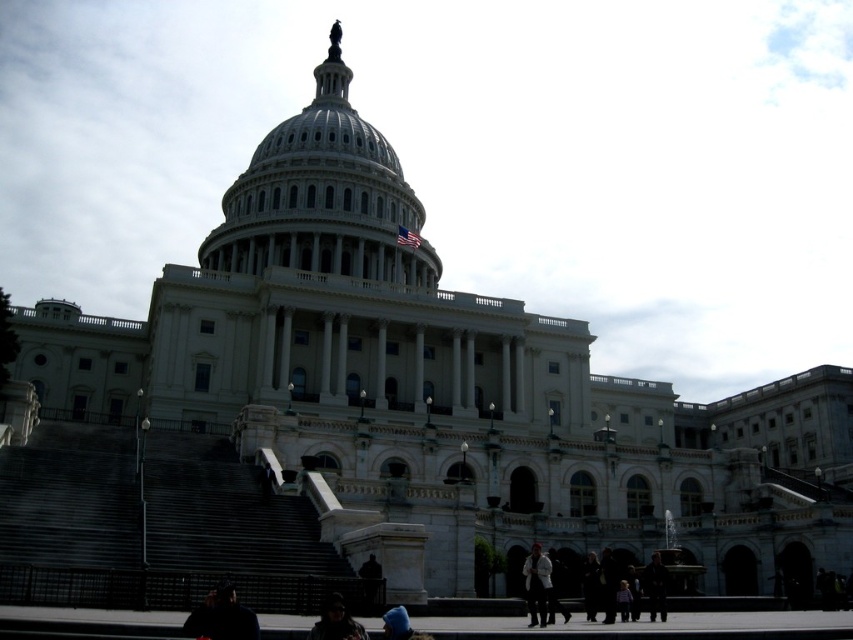
Which is above, dark brown leather jacket at lower right or dark clothing at lower center?

dark brown leather jacket at lower right

Can you confirm if dark brown leather jacket at lower right is taller than dark clothing at lower center?

No, dark brown leather jacket at lower right is not taller than dark clothing at lower center.

Which is in front, point (660, 605) or point (592, 600)?

Positioned in front is point (592, 600).

Where is `dark brown leather jacket at lower right`? This screenshot has width=853, height=640. dark brown leather jacket at lower right is located at coordinates (654, 586).

Who is taller, dark gray stone stairs at lower left or matte black jacket at lower center?

Standing taller between the two is dark gray stone stairs at lower left.

Does dark gray stone stairs at lower left lie in front of matte black jacket at lower center?

No, dark gray stone stairs at lower left is further to the viewer.

Which is in front, point (149, 554) or point (360, 628)?

Point (360, 628) is more forward.

The height and width of the screenshot is (640, 853). Find the location of `dark gray stone stairs at lower left`. dark gray stone stairs at lower left is located at coordinates (155, 525).

Does light gray fabric jacket at lower center have a lesser height compared to matte black jacket at lower center?

Incorrect, light gray fabric jacket at lower center's height does not fall short of matte black jacket at lower center's.

Measure the distance from light gray fabric jacket at lower center to matte black jacket at lower center.

light gray fabric jacket at lower center is 15.09 meters from matte black jacket at lower center.

Locate an element on the screen. This screenshot has height=640, width=853. light gray fabric jacket at lower center is located at coordinates (537, 584).